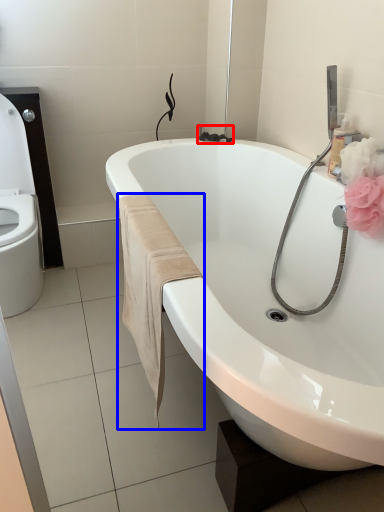
Question: Which object appears closest to the camera in this image, plumbing fixture (highlighted by a red box) or bath towel (highlighted by a blue box)?

Choices:
 (A) plumbing fixture
 (B) bath towel

Answer: (B)